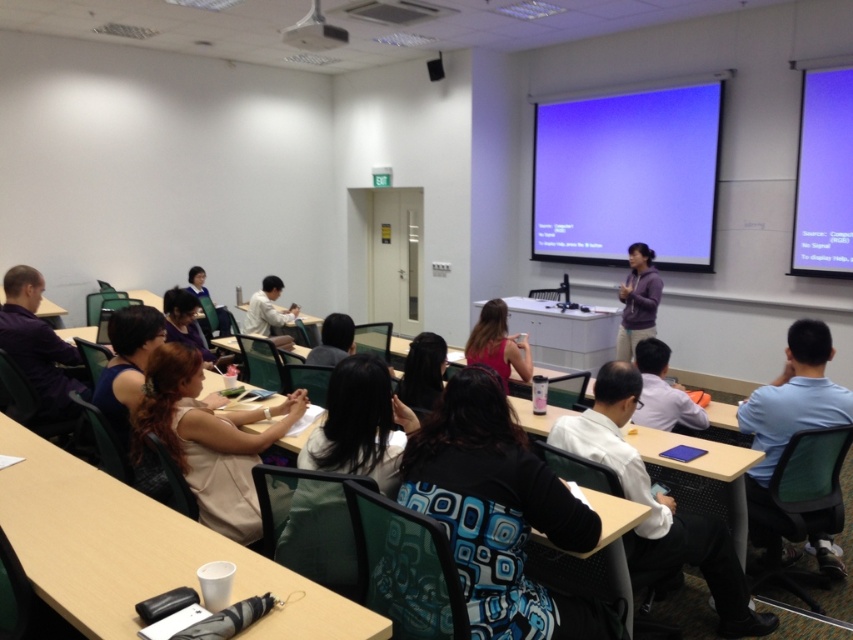
Question: Which object is positioned farthest from the matte pink shirt at center?

Choices:
 (A) dark brown hair at center
 (B) matte white shirt at center

Answer: (B)

Question: Is matte white shirt at center behind matte black table at left?

Choices:
 (A) no
 (B) yes

Answer: (B)

Question: Observing the image, what is the correct spatial positioning of blue matte projection screen at upper center in reference to white shirt at center?

Choices:
 (A) below
 (B) above

Answer: (B)

Question: Which of the following is the closest to the observer?

Choices:
 (A) patterned fabric shirt at center
 (B) purple matte jacket at left

Answer: (A)

Question: Can you confirm if blue matte projection screen at upper right is wider than purple matte sweater at center?

Choices:
 (A) yes
 (B) no

Answer: (A)

Question: Which point is closer to the camera taking this photo?

Choices:
 (A) (7, 486)
 (B) (788, 438)
 (C) (428, 371)
 (D) (809, 236)

Answer: (A)